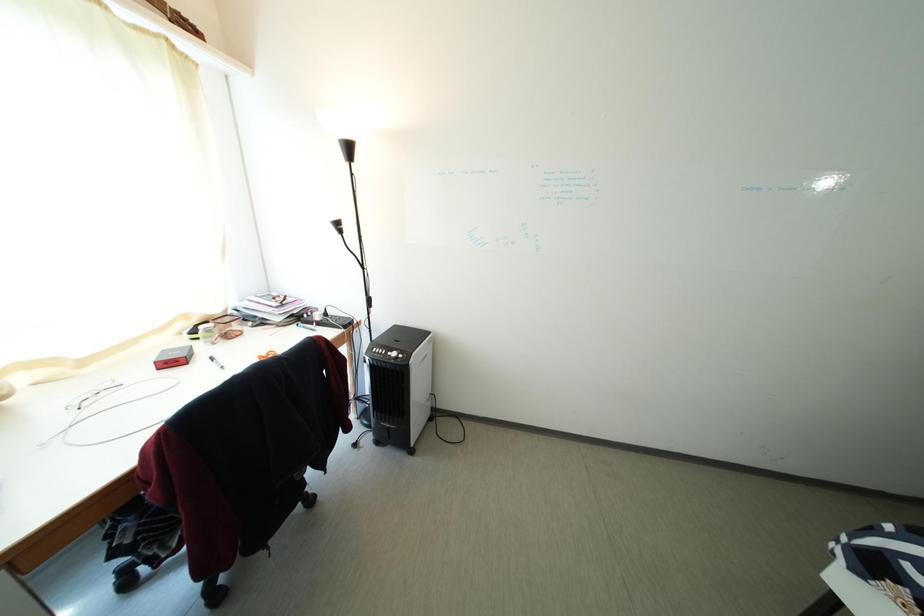
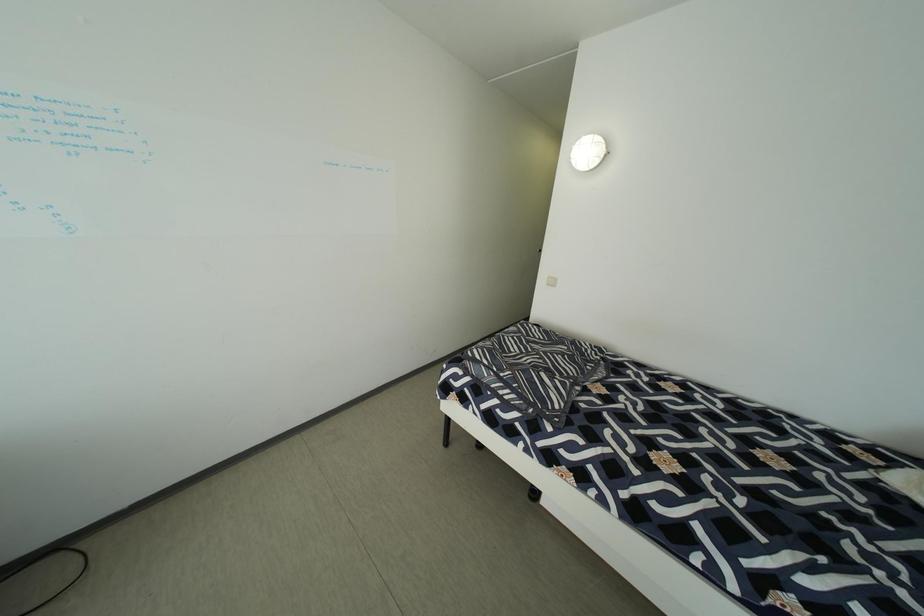
Question: The camera is either moving clockwise (left) or counter-clockwise (right) around the object. The first image is from the beginning of the video and the second image is from the end. Is the camera moving left or right when shooting the video?

Choices:
 (A) Left
 (B) Right

Answer: (A)